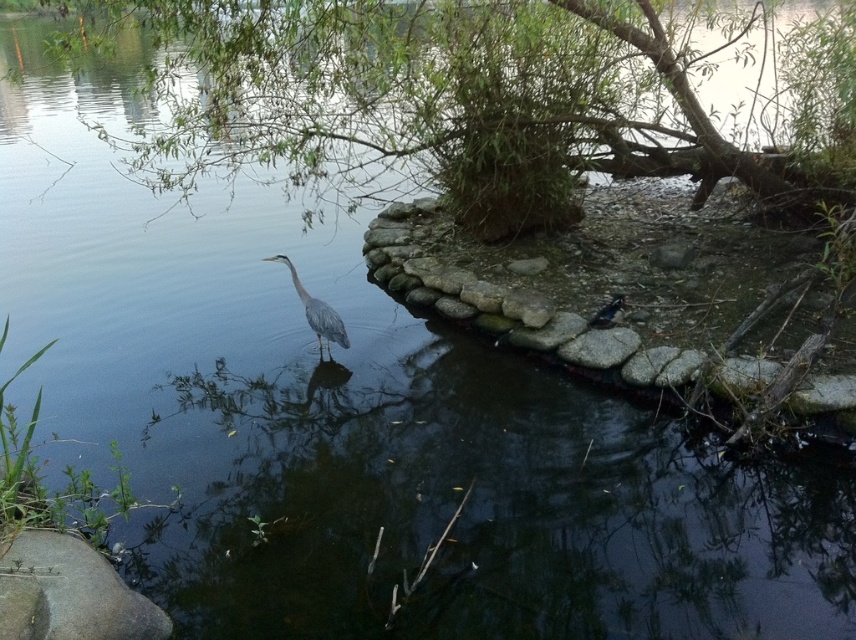
Can you confirm if green leafy tree at upper center is taller than gray stone at lower left?

Correct, green leafy tree at upper center is much taller as gray stone at lower left.

The image size is (856, 640). In order to click on green leafy tree at upper center in this screenshot , I will do `click(477, 97)`.

Which is above, gray matte bird at center or shiny black bird at center?

Positioned higher is shiny black bird at center.

What are the coordinates of `gray matte bird at center` in the screenshot? It's located at (316, 310).

Identify the location of gray matte bird at center. The width and height of the screenshot is (856, 640). (316, 310).

Based on the photo, does gray stone at lower left appear on the right side of gray matte bird at center?

No, gray stone at lower left is not to the right of gray matte bird at center.

Who is lower down, gray stone at lower left or gray matte bird at center?

gray stone at lower left is below.

This screenshot has height=640, width=856. I want to click on gray stone at lower left, so click(69, 593).